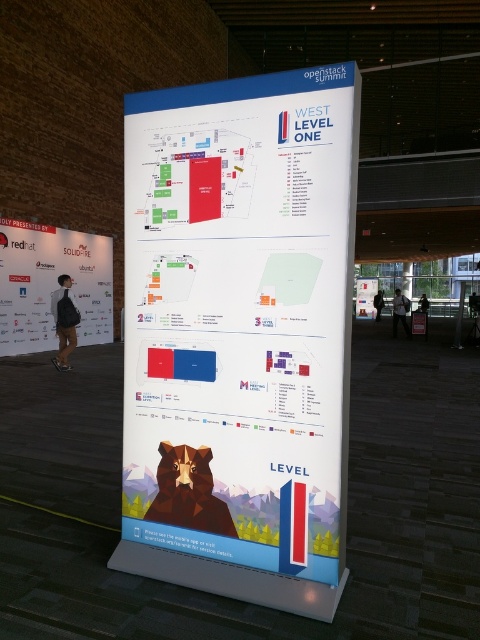
Question: Is white paper at center behind white glossy poster at center?

Choices:
 (A) no
 (B) yes

Answer: (A)

Question: Which is nearer to the white paper at center?

Choices:
 (A) white glossy poster at center
 (B) white matte banner at left

Answer: (B)

Question: Which point is farther to the camera?

Choices:
 (A) white glossy poster at center
 (B) white paper at center

Answer: (A)

Question: Does white paper at center have a larger size compared to white matte banner at left?

Choices:
 (A) yes
 (B) no

Answer: (B)

Question: Which is farther from the white paper at center?

Choices:
 (A) white glossy poster at center
 (B) white matte banner at left

Answer: (A)

Question: Is white paper at center to the right of white glossy poster at center from the viewer's perspective?

Choices:
 (A) no
 (B) yes

Answer: (A)